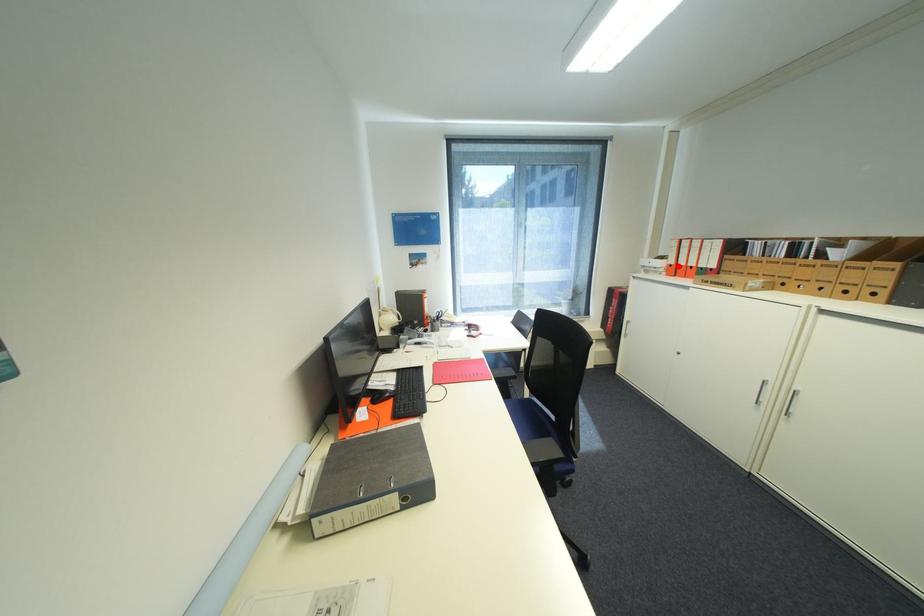
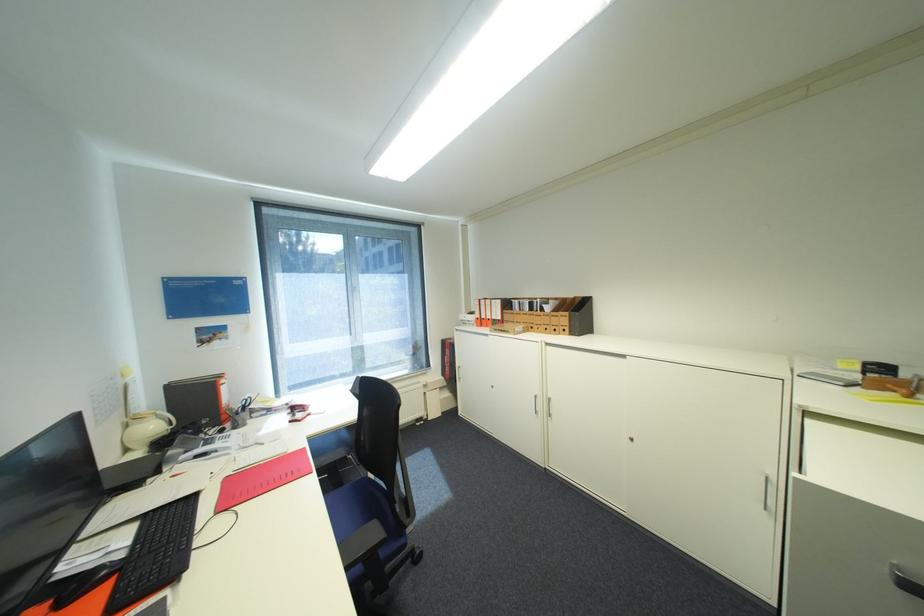
Find the pixel in the second image that matches the highlighted location in the first image.

(485, 318)